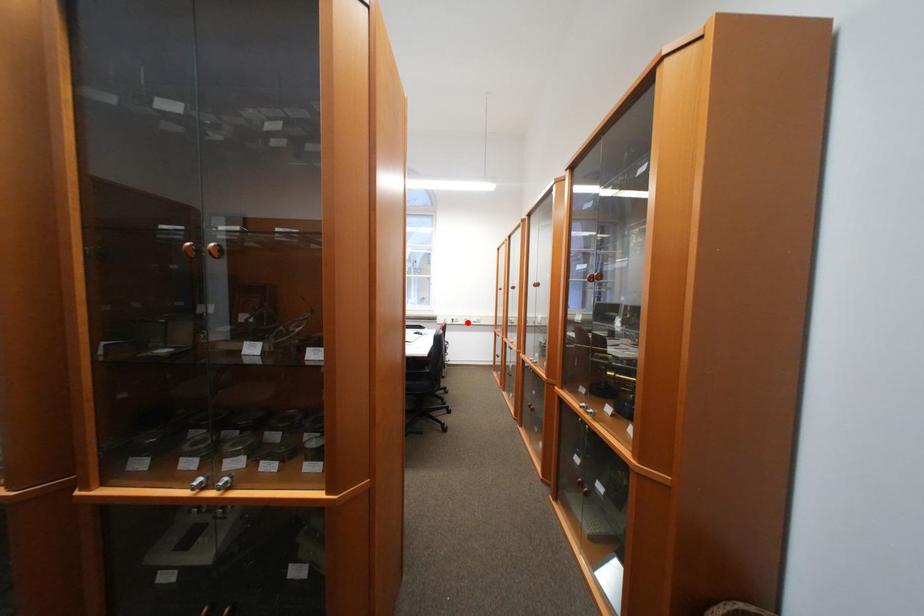
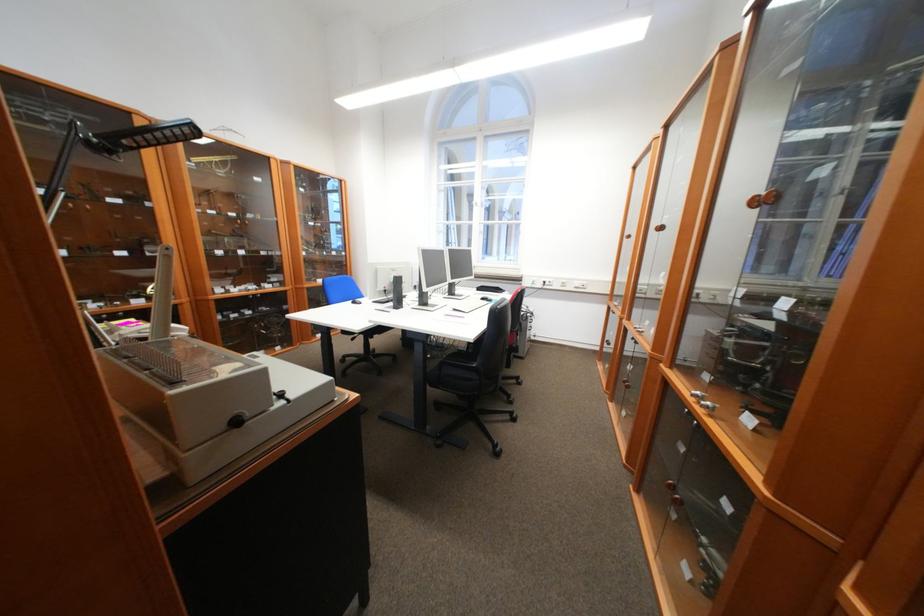
Locate, in the second image, the point that corresponds to the highlighted location in the first image.

(562, 286)